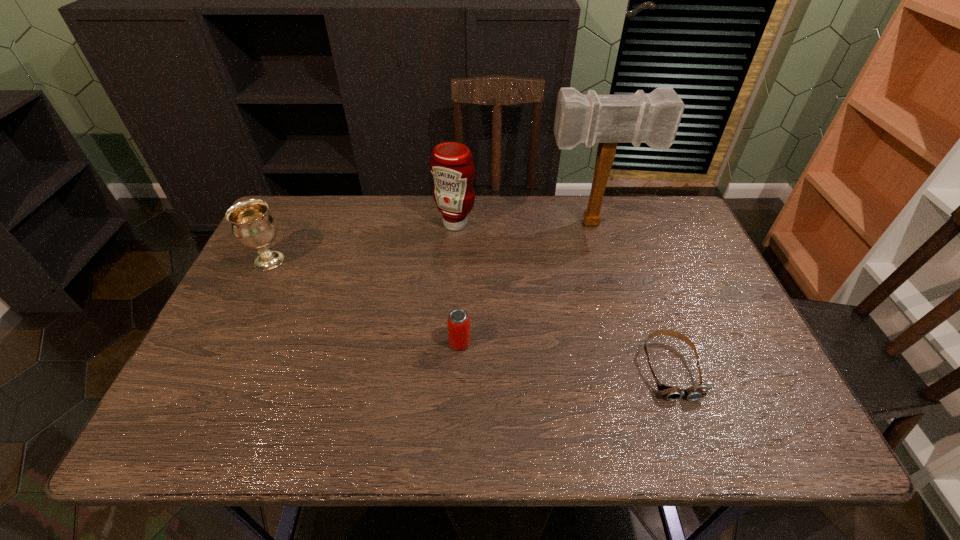
At what (x,y) coordinates should I click in order to perform the action: click on mallet. Please return your answer as a coordinate pair (x, y). This screenshot has height=540, width=960. Looking at the image, I should click on (653, 119).

Find the location of `condiment`. condiment is located at coordinates (451, 164).

This screenshot has width=960, height=540. Identify the location of the third nearest object. coord(253,226).

Identify the location of the third tallest object. (253, 226).

This screenshot has height=540, width=960. Find the location of `the second shortest object`. the second shortest object is located at coordinates (458, 320).

Find the location of a particular element. The height and width of the screenshot is (540, 960). goggles is located at coordinates (671, 393).

The image size is (960, 540). I want to click on free space located 0.080m on the left of the tallest object, so (x=518, y=224).

I want to click on vacant area located on the right of the fourth shortest object, so click(x=590, y=224).

At what (x,y) coordinates should I click in order to perform the action: click on vacant space located on the right of the chalice. Please return your answer as a coordinate pair (x, y). Image resolution: width=960 pixels, height=540 pixels. Looking at the image, I should click on (411, 261).

Image resolution: width=960 pixels, height=540 pixels. Find the location of `free point located 0.090m on the left of the beer can`. free point located 0.090m on the left of the beer can is located at coordinates (411, 343).